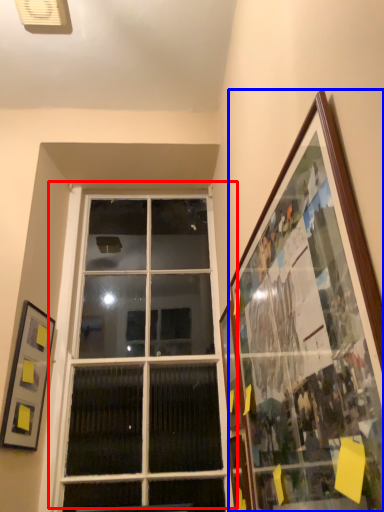
Question: Which object appears farthest to the camera in this image, window (highlighted by a red box) or picture frame (highlighted by a blue box)?

Choices:
 (A) window
 (B) picture frame

Answer: (A)